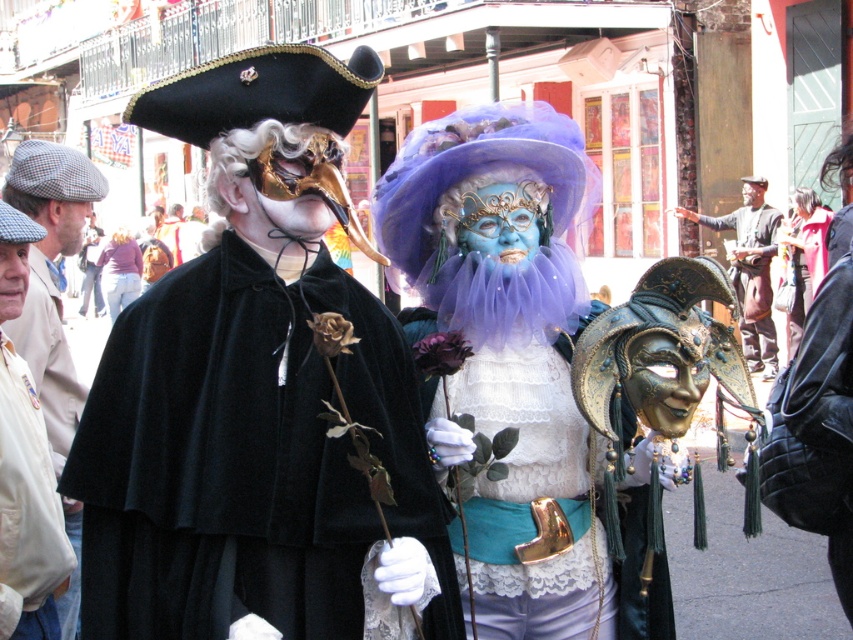
Which is below, velvet black cape at center or velvet cape at center?

velvet black cape at center is lower down.

Can you confirm if velvet black cape at center is bigger than velvet cape at center?

Incorrect, velvet black cape at center is not larger than velvet cape at center.

Is point (344, 470) behind point (801, 273)?

No, it is not.

The width and height of the screenshot is (853, 640). What are the coordinates of `velvet black cape at center` in the screenshot? It's located at (247, 458).

Between light beige fabric cap at left and velvet cape at center, which one has less height?

Standing shorter between the two is velvet cape at center.

Between light beige fabric cap at left and velvet cape at center, which one has more height?

With more height is light beige fabric cap at left.

Is point (67, 237) behind point (798, 248)?

No.

I want to click on light beige fabric cap at left, so click(51, 275).

Between point (770, 355) and point (790, 333), which one is positioned behind?

The point (770, 355) is more distant.

Where is `brown leather jacket at upper right`? The width and height of the screenshot is (853, 640). brown leather jacket at upper right is located at coordinates (750, 269).

Which is behind, point (746, 246) or point (798, 198)?

Positioned behind is point (746, 246).

At what (x,y) coordinates should I click in order to perform the action: click on brown leather jacket at upper right. Please return your answer as a coordinate pair (x, y). This screenshot has height=640, width=853. Looking at the image, I should click on (750, 269).